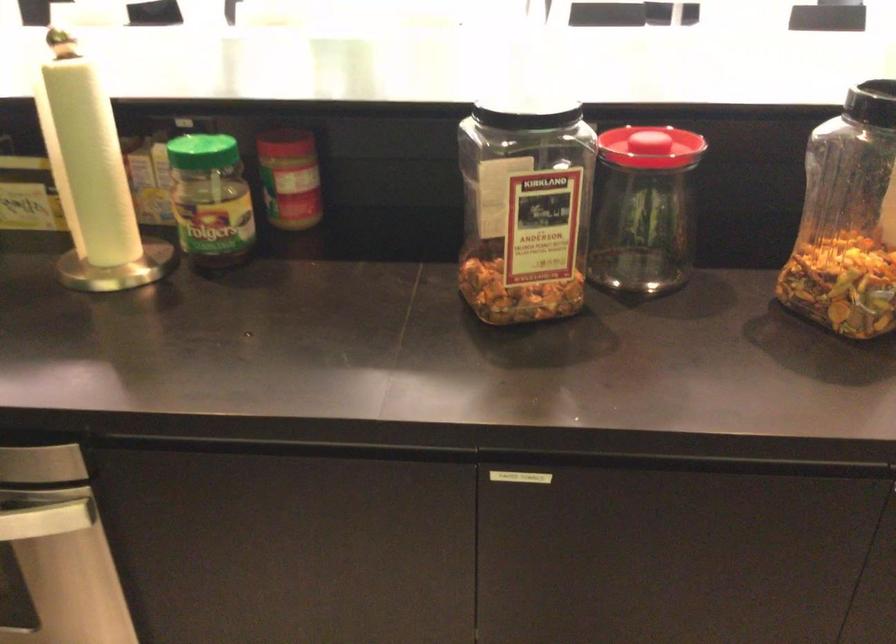
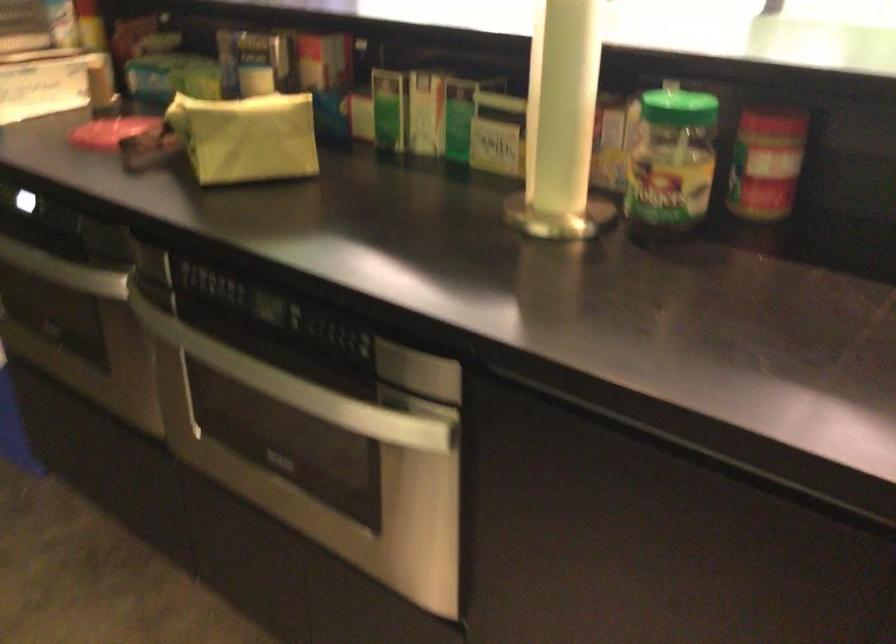
In the second image, find the point that corresponds to the point at 92,163 in the first image.

(563, 102)